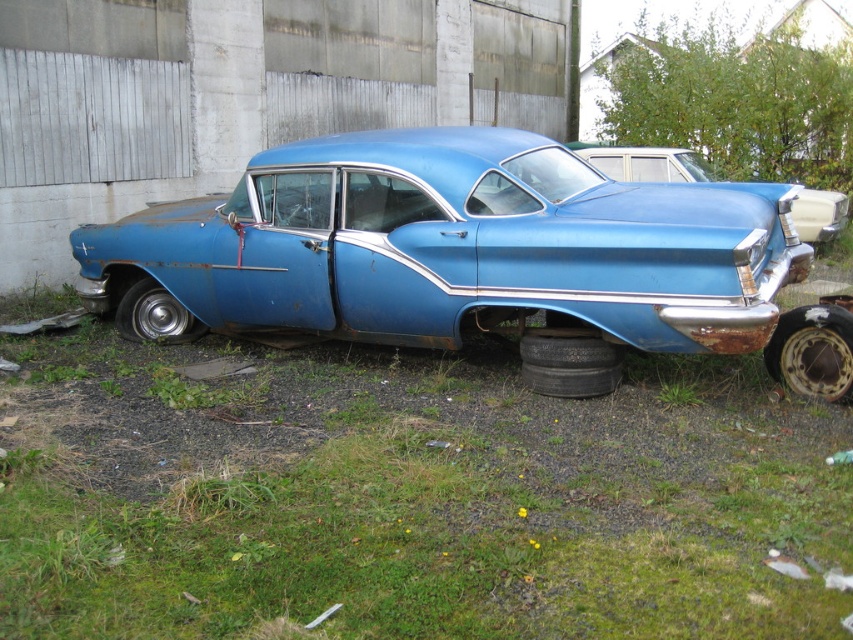
From the picture: You are standing at the edge of an abandoned lot and see the rusty metal tire at lower left and green grass at lower center. Which object is closer to your right side?

The green grass at lower center is to the right of the rusty metal tire at lower left, so it is closer to your right side.

You are standing at the center of the image and want to walk towards the green grass at lower center. What coordinates should you aim for?

You should aim for the coordinates at point (410, 497) where the green grass at lower center is located.

You are a mechanic inspecting an old car in a junkyard. You notice the rusty metallic car at right and the black rubber tire at lower right. Which object is positioned higher from the ground?

The rusty metallic car at right is located above the black rubber tire at lower right, so it is positioned higher from the ground.